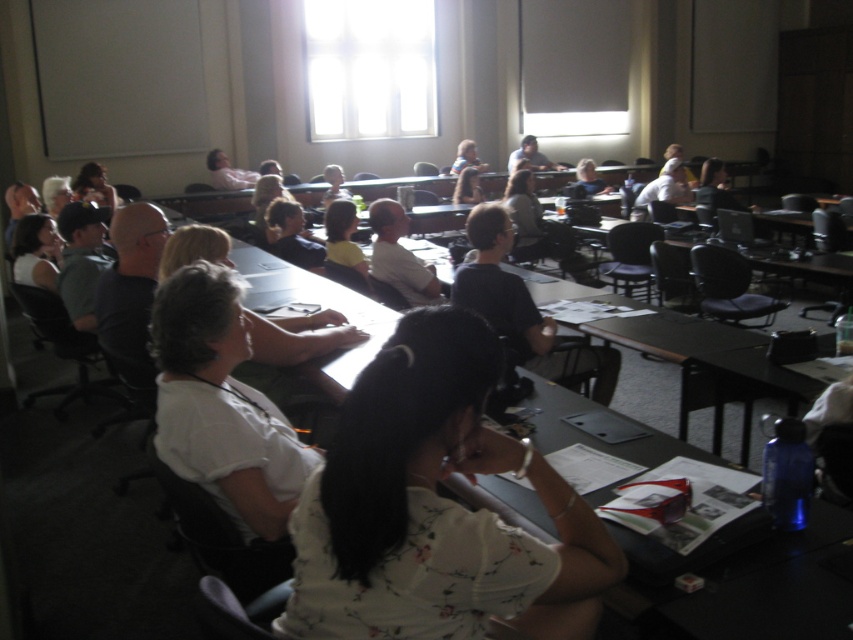
You are a student sitting at the back of the classroom near the window. You want to see the presentation on the matte black laptop at center but there is someone in front of you wearing a matte white shirt at upper left. Can you see the laptop screen over their head?

The matte white shirt at upper left is much taller than the matte black laptop at center, so you cannot see the laptop screen over their head because the person wearing the matte white shirt at upper left is taller and would block your view.

From the picture: You are standing at the entrance of the classroom and want to locate the white floral shirt at center. According to the coordinates provided, in which direction should you look to find it?

The white floral shirt at center is located at coordinates point (434, 508), which means it is positioned towards the upper right direction from your current position at the entrance.